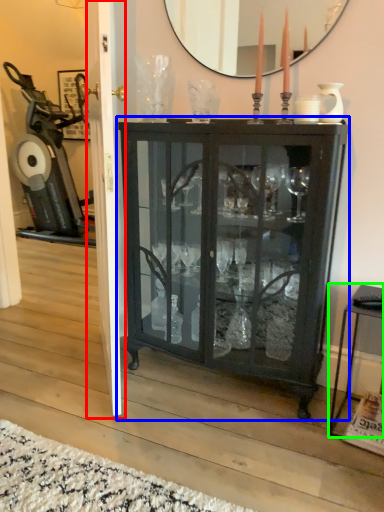
Question: Which is farther away from screen door (highlighted by a red box)? cupboard (highlighted by a blue box) or table (highlighted by a green box)?

Choices:
 (A) cupboard
 (B) table

Answer: (B)